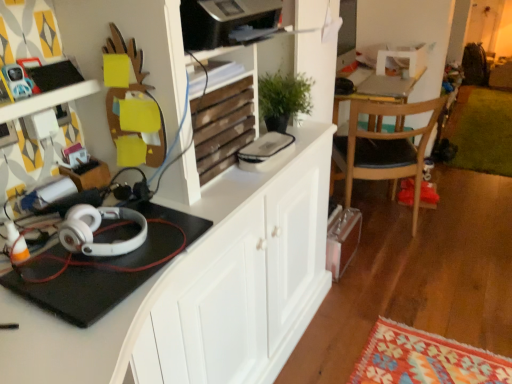
Image resolution: width=512 pixels, height=384 pixels. In order to click on free spot in front of white matte headphones at left in this screenshot , I will do `click(89, 279)`.